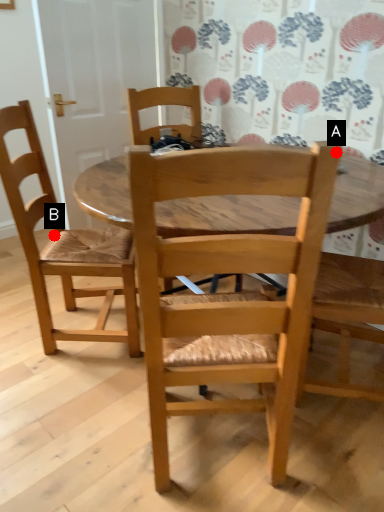
Question: Two points are circled on the image, labeled by A and B beside each circle. Which point is farther to the camera?

Choices:
 (A) A is further
 (B) B is further

Answer: (B)